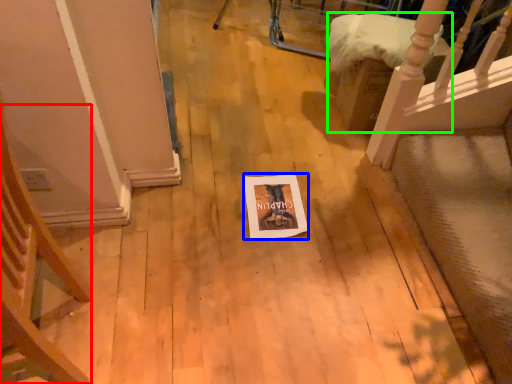
Question: Which is farther away from armchair (highlighted by a red box)? postcard (highlighted by a blue box) or furniture (highlighted by a green box)?

Choices:
 (A) postcard
 (B) furniture

Answer: (B)